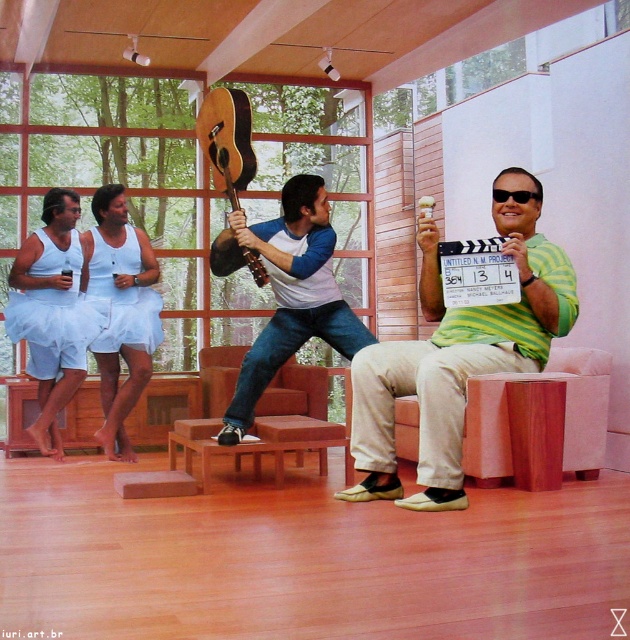
Is green striped shirt at center above denim jeans at center?

Incorrect, green striped shirt at center is not positioned above denim jeans at center.

Locate an element on the screen. This screenshot has width=630, height=640. green striped shirt at center is located at coordinates (457, 355).

Between point (541, 324) and point (309, 285), which one is positioned in front?

Point (541, 324)

I want to click on green striped shirt at center, so click(x=457, y=355).

Can you confirm if light blue tulle skirt at left is shorter than natural wood acoustic guitar at center?

No.

Between light blue tulle skirt at left and natural wood acoustic guitar at center, which one appears on the right side from the viewer's perspective?

From the viewer's perspective, natural wood acoustic guitar at center appears more on the right side.

The height and width of the screenshot is (640, 630). Describe the element at coordinates (52, 312) in the screenshot. I see `light blue tulle skirt at left` at that location.

Image resolution: width=630 pixels, height=640 pixels. Identify the location of light blue tulle skirt at left. (52, 312).

Does light blue tulle skirt at left appear on the left side of white fabric skirt at left?

Correct, you'll find light blue tulle skirt at left to the left of white fabric skirt at left.

How far apart are light blue tulle skirt at left and white fabric skirt at left?

light blue tulle skirt at left and white fabric skirt at left are 10.56 inches apart.

Who is more distant from viewer, (76, 333) or (120, 406)?

Positioned behind is point (76, 333).

The height and width of the screenshot is (640, 630). In order to click on light blue tulle skirt at left in this screenshot , I will do `click(52, 312)`.